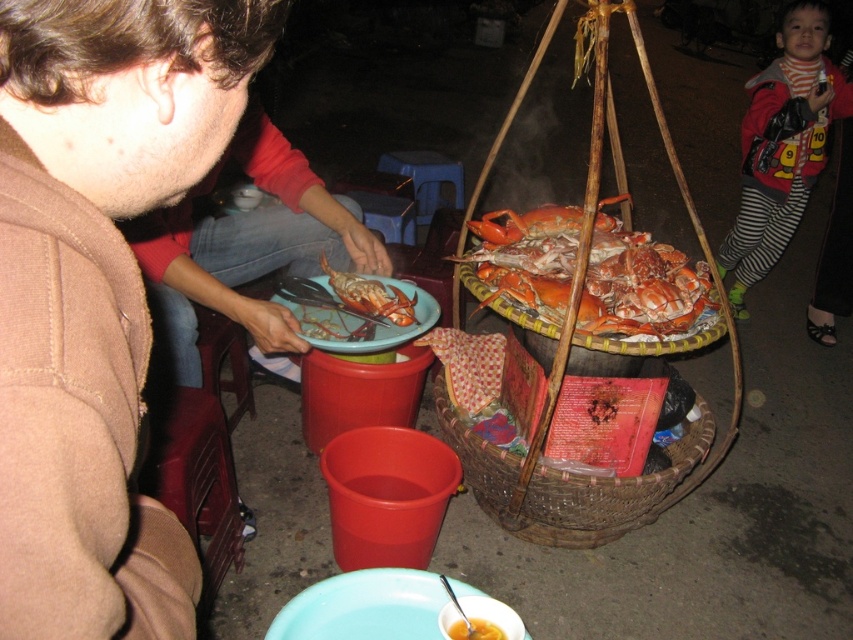
You are a customer at the night market and want to know which item is taller between the brown woolen sweater at upper left and the woven brown basket at lower center. Can you tell me?

The brown woolen sweater at upper left is taller than the woven brown basket at lower center.

You are a food vendor who needs to place a new order of crabs next to the yellow matte soup at lower center. The new order must be placed within 1 meter of the soup to keep it warm. Can you place the woven brown basket at lower center there?

The woven brown basket at lower center is currently 94.93 centimeters away from the yellow matte soup at lower center. Since 94.93 cm is less than 1 meter, placing the basket there would keep it within the required distance.

You are standing in the street food scene and want to know which of the two points, point (672,312) or point (498,474), is nearer to you. Can you determine this based on the image?

Point (672,312) is closer to the viewer than point (498,474).